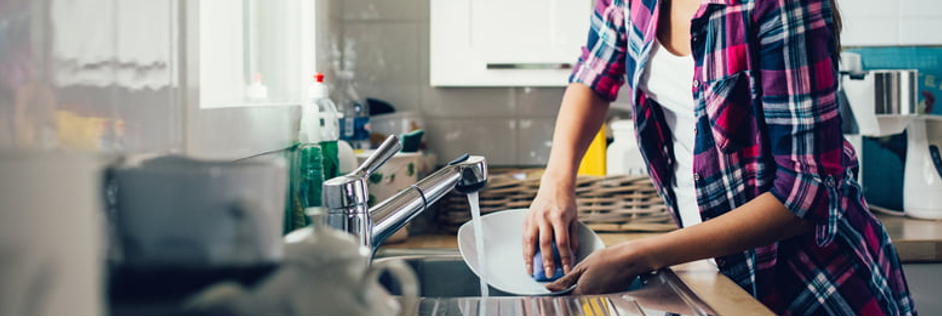
What are the coordinates of `kitchen sink` in the screenshot? It's located at (452, 273).